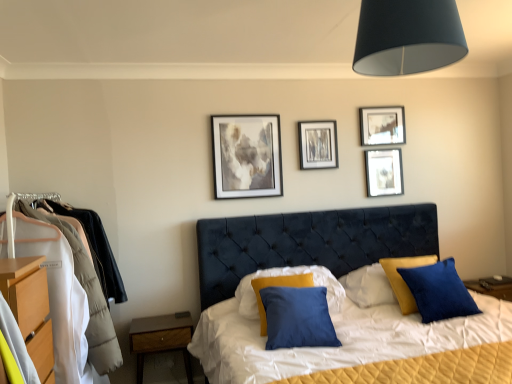
Question: Can you confirm if blue cotton pillow at center, the second pillow in the left-to-right sequence, is shorter than matte black picture frame at upper right, acting as the second picture frame starting from the right?

Choices:
 (A) yes
 (B) no

Answer: (B)

Question: Does blue cotton pillow at center, which is the 1th pillow from right to left, lie in front of matte black picture frame at upper right, acting as the second picture frame starting from the right?

Choices:
 (A) no
 (B) yes

Answer: (B)

Question: Is blue cotton pillow at center, the second pillow in the left-to-right sequence, completely or partially outside of matte black picture frame at upper right, the third picture frame positioned from the left?

Choices:
 (A) yes
 (B) no

Answer: (A)

Question: From a real-world perspective, is blue cotton pillow at center, which is the 1th pillow from right to left, positioned over matte black picture frame at upper right, the third picture frame positioned from the left, based on gravity?

Choices:
 (A) yes
 (B) no

Answer: (B)

Question: From a real-world perspective, is blue cotton pillow at center, which is the 1th pillow from right to left, below matte black picture frame at upper right, acting as the second picture frame starting from the right?

Choices:
 (A) yes
 (B) no

Answer: (A)

Question: Choose the correct answer: Is brown wood nightstand at lower left inside metallic silver picture frame at upper center, the 3th picture frame in the right-to-left sequence, or outside it?

Choices:
 (A) inside
 (B) outside

Answer: (B)

Question: Is brown wood nightstand at lower left to the left or to the right of metallic silver picture frame at upper center, which is the second picture frame in left-to-right order, in the image?

Choices:
 (A) left
 (B) right

Answer: (A)

Question: In terms of width, does brown wood nightstand at lower left look wider or thinner when compared to metallic silver picture frame at upper center, which is the second picture frame in left-to-right order?

Choices:
 (A) wide
 (B) thin

Answer: (A)

Question: Is point (140, 354) positioned closer to the camera than point (334, 125)?

Choices:
 (A) closer
 (B) farther

Answer: (A)

Question: Considering the positions of point (316, 281) and point (375, 190), is point (316, 281) closer or farther from the camera than point (375, 190)?

Choices:
 (A) closer
 (B) farther

Answer: (A)

Question: Considering the positions of satin blue pillow at center, which appears as the 1th pillow when viewed from the left, and matte silver picture frame at upper right, the 1th picture frame from the right, in the image, is satin blue pillow at center, which appears as the 1th pillow when viewed from the left, bigger or smaller than matte silver picture frame at upper right, the 1th picture frame from the right,?

Choices:
 (A) big
 (B) small

Answer: (A)

Question: From the image's perspective, is satin blue pillow at center, which appears as the 1th pillow when viewed from the left, located above or below matte silver picture frame at upper right, which is the fourth picture frame from left to right?

Choices:
 (A) above
 (B) below

Answer: (B)

Question: Considering the positions of satin blue pillow at center, arranged as the 2th pillow when viewed from the right, and matte silver picture frame at upper right, the 1th picture frame from the right, in the image, is satin blue pillow at center, arranged as the 2th pillow when viewed from the right, wider or thinner than matte silver picture frame at upper right, the 1th picture frame from the right,?

Choices:
 (A) wide
 (B) thin

Answer: (A)

Question: Looking at the image, does wooden dresser at left seem bigger or smaller compared to matte gray painting at upper center, marked as the 1th picture frame in a left-to-right arrangement?

Choices:
 (A) small
 (B) big

Answer: (B)

Question: Relative to matte gray painting at upper center, which appears as the fourth picture frame when viewed from the right, is wooden dresser at left in front or behind?

Choices:
 (A) behind
 (B) front

Answer: (B)